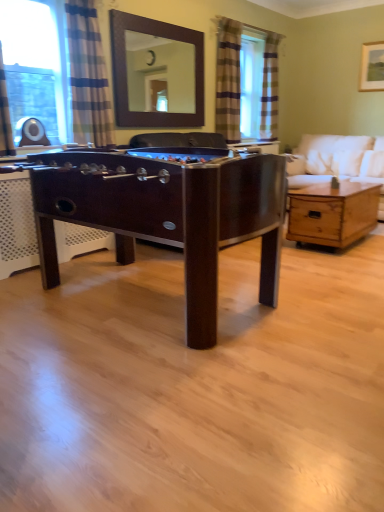
I want to click on free point below dark wood foosball table at center (from a real-world perspective), so click(x=144, y=307).